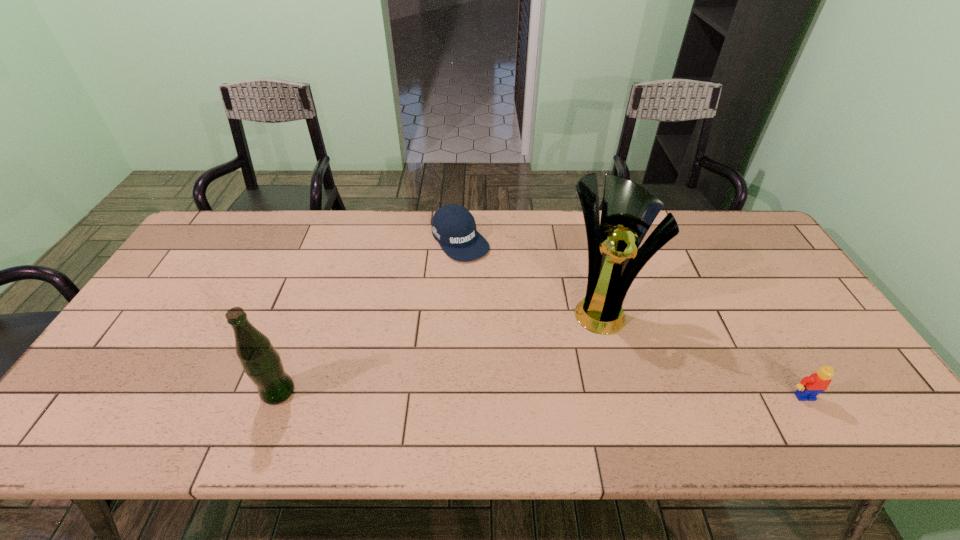
Identify the location of vacant space at the near edge of the desktop. (540, 383).

The image size is (960, 540). In the image, there is a desktop. What are the coordinates of `blank space at the left edge` in the screenshot? It's located at (191, 332).

In the image, there is a desktop. Identify the location of free region at the right edge. The image size is (960, 540). (762, 284).

In the image, there is a desktop. In order to click on vacant region at the far left corner in this screenshot , I will do `click(238, 224)`.

Locate an element on the screen. vacant space at the near left corner is located at coordinates (116, 378).

The width and height of the screenshot is (960, 540). In the image, there is a desktop. Find the location of `vacant space at the far right corner`. vacant space at the far right corner is located at coordinates (741, 227).

I want to click on blank region between the second tallest object and the Lego, so click(541, 394).

Where is `free space that is in between the third shortest object and the award`? free space that is in between the third shortest object and the award is located at coordinates (439, 350).

Image resolution: width=960 pixels, height=540 pixels. I want to click on unoccupied position between the beer bottle and the farthest object, so click(370, 316).

The width and height of the screenshot is (960, 540). In order to click on blank region between the rightmost object and the third nearest object in this screenshot , I will do `click(702, 352)`.